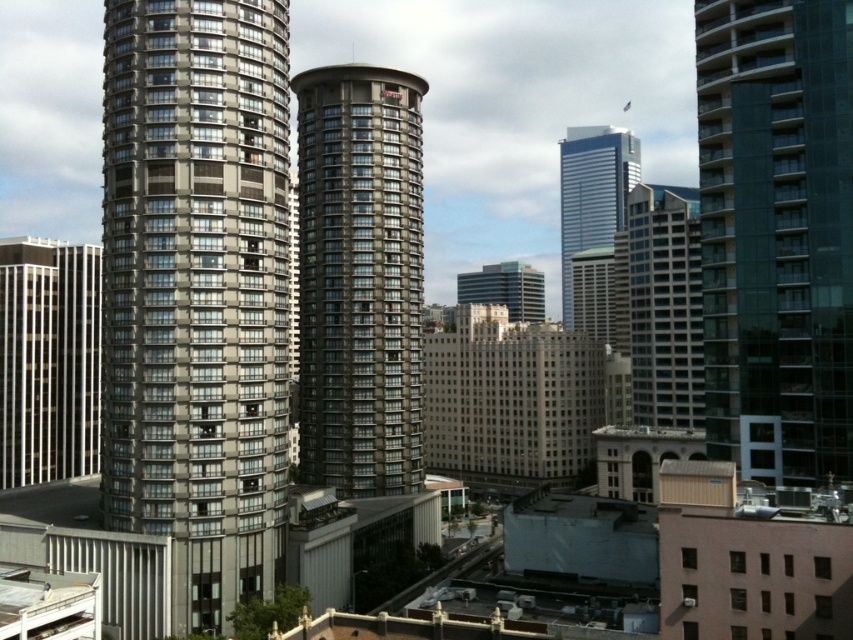
Can you confirm if glassy teal skyscraper at right is positioned to the right of shiny glass skyscraper at center?

No, glassy teal skyscraper at right is not to the right of shiny glass skyscraper at center.

Where is `glassy teal skyscraper at right`? This screenshot has width=853, height=640. glassy teal skyscraper at right is located at coordinates (776, 234).

Between point (747, 355) and point (683, 381), which one is positioned behind?

The point (683, 381) is behind.

Where is `glassy teal skyscraper at right`? The image size is (853, 640). glassy teal skyscraper at right is located at coordinates (776, 234).

Which is more to the left, gray glassy building at center or glassy gray skyscraper at center?

From the viewer's perspective, gray glassy building at center appears more on the left side.

Who is lower down, gray glassy building at center or glassy gray skyscraper at center?

Positioned lower is gray glassy building at center.

Who is more distant from viewer, (397, 240) or (677, 236)?

Point (677, 236)

What are the coordinates of `gray glassy building at center` in the screenshot? It's located at (358, 278).